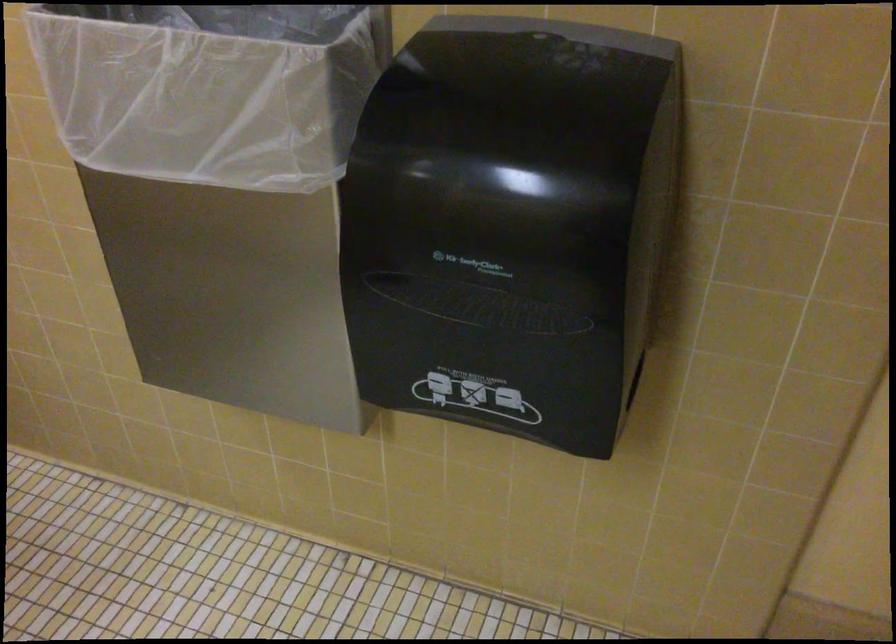
The first image is from the beginning of the video and the second image is from the end. How did the camera likely rotate when shooting the video?

The camera's rotation is toward left-down.